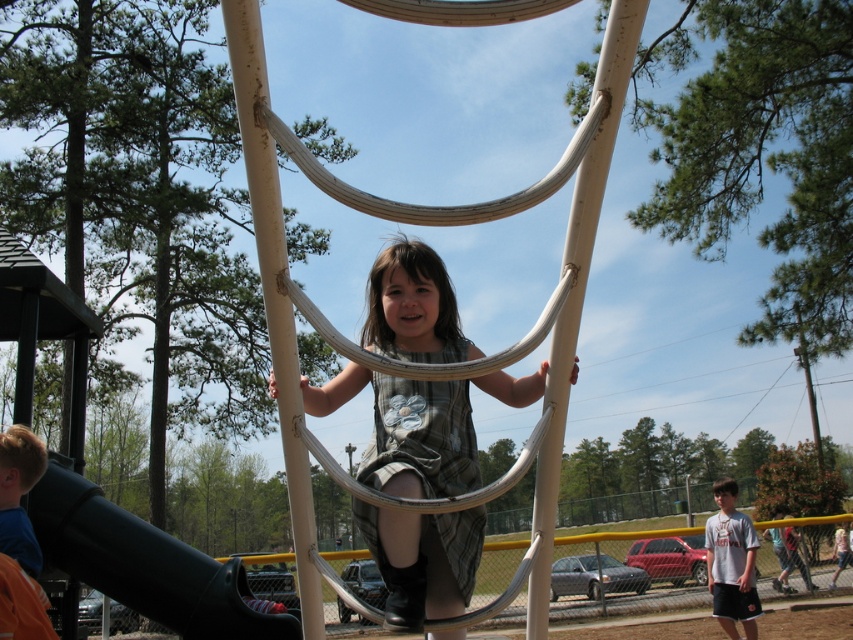
You are standing at the playground and want to reach a specific point marked at coordinates point (368, 532). Considering the distance from you to this point is 2.51 meters, can you estimate how far you need to walk to get there?

The distance of point (368, 532) from viewer is 2.51 meters, so you need to walk approximately 2.51 meters to reach it.

You are a photographer trying to capture the exact spot where the matte gray dress at center is located. According to the coordinates provided, where should you position your camera to ensure the dress is centered in the frame?

The matte gray dress at center is located at coordinates point (407, 432), so you should position your camera to center the frame at those coordinates to capture the dress precisely.